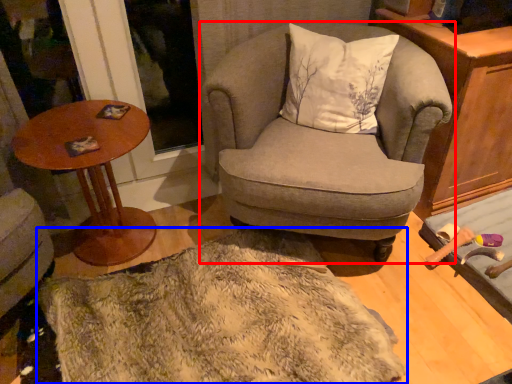
Question: Among these objects, which one is nearest to the camera, chair (highlighted by a red box) or blanket (highlighted by a blue box)?

Choices:
 (A) chair
 (B) blanket

Answer: (B)